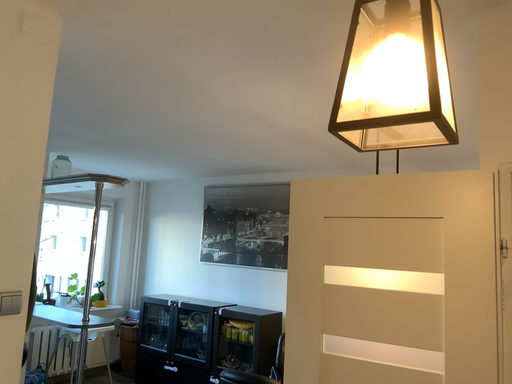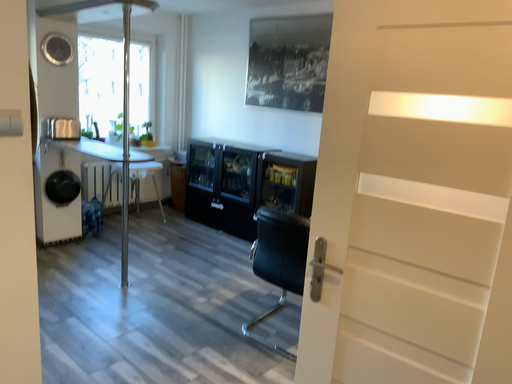
Question: How did the camera likely rotate when shooting the video?

Choices:
 (A) rotated upward
 (B) rotated downward

Answer: (B)